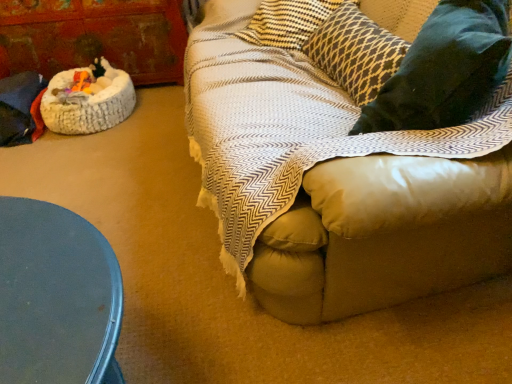
Question: From a real-world perspective, is rustic wood armoire at left under dark gray textured pillow at upper right?

Choices:
 (A) no
 (B) yes

Answer: (B)

Question: From a real-world perspective, is rustic wood armoire at left physically above dark gray textured pillow at upper right?

Choices:
 (A) yes
 (B) no

Answer: (B)

Question: Can you confirm if rustic wood armoire at left is positioned to the right of dark gray textured pillow at upper right?

Choices:
 (A) no
 (B) yes

Answer: (A)

Question: Is the depth of rustic wood armoire at left greater than that of dark gray textured pillow at upper right?

Choices:
 (A) yes
 (B) no

Answer: (A)

Question: From the image's perspective, is rustic wood armoire at left under dark gray textured pillow at upper right?

Choices:
 (A) yes
 (B) no

Answer: (B)

Question: Is the position of rustic wood armoire at left less distant than that of dark gray textured pillow at upper right?

Choices:
 (A) yes
 (B) no

Answer: (B)

Question: Can we say velvety dark green pillow at right lies outside rustic wood armoire at left?

Choices:
 (A) no
 (B) yes

Answer: (B)

Question: Is velvety dark green pillow at right next to rustic wood armoire at left?

Choices:
 (A) yes
 (B) no

Answer: (B)

Question: Is rustic wood armoire at left located within velvety dark green pillow at right?

Choices:
 (A) yes
 (B) no

Answer: (B)

Question: From the image's perspective, is velvety dark green pillow at right over rustic wood armoire at left?

Choices:
 (A) no
 (B) yes

Answer: (A)

Question: Does velvety dark green pillow at right have a smaller size compared to rustic wood armoire at left?

Choices:
 (A) yes
 (B) no

Answer: (A)

Question: Is the depth of velvety dark green pillow at right greater than that of rustic wood armoire at left?

Choices:
 (A) yes
 (B) no

Answer: (B)

Question: Is dark gray textured pillow at upper right positioned far away from white fluffy cat bed at left?

Choices:
 (A) no
 (B) yes

Answer: (B)